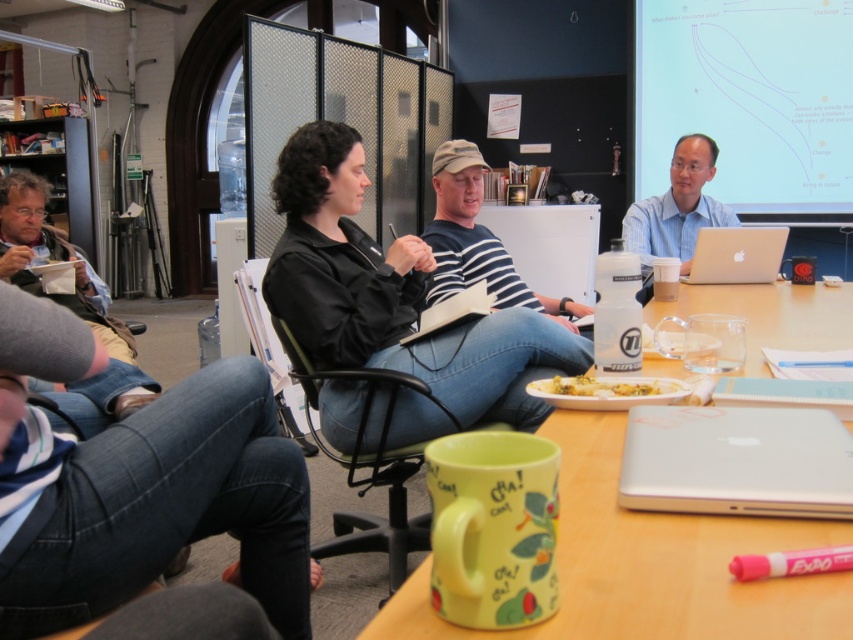
Question: Does silver metallic laptop at lower right lie behind blue shirt at upper right?

Choices:
 (A) no
 (B) yes

Answer: (A)

Question: Is silver metallic laptop at lower right below silver metallic laptop at center?

Choices:
 (A) yes
 (B) no

Answer: (A)

Question: Among these points, which one is nearest to the camera?

Choices:
 (A) (628, 228)
 (B) (361, 464)
 (C) (561, 368)

Answer: (C)

Question: Which of the following is the farthest from the observer?

Choices:
 (A) (756, 180)
 (B) (610, 392)
 (C) (370, 282)
 (D) (368, 460)

Answer: (A)

Question: Among these points, which one is nearest to the camera?

Choices:
 (A) (561, 388)
 (B) (682, 557)
 (C) (744, 170)
 (D) (450, 220)

Answer: (B)

Question: Is white matte projection screen at upper right to the right of blue shirt at upper right from the viewer's perspective?

Choices:
 (A) yes
 (B) no

Answer: (A)